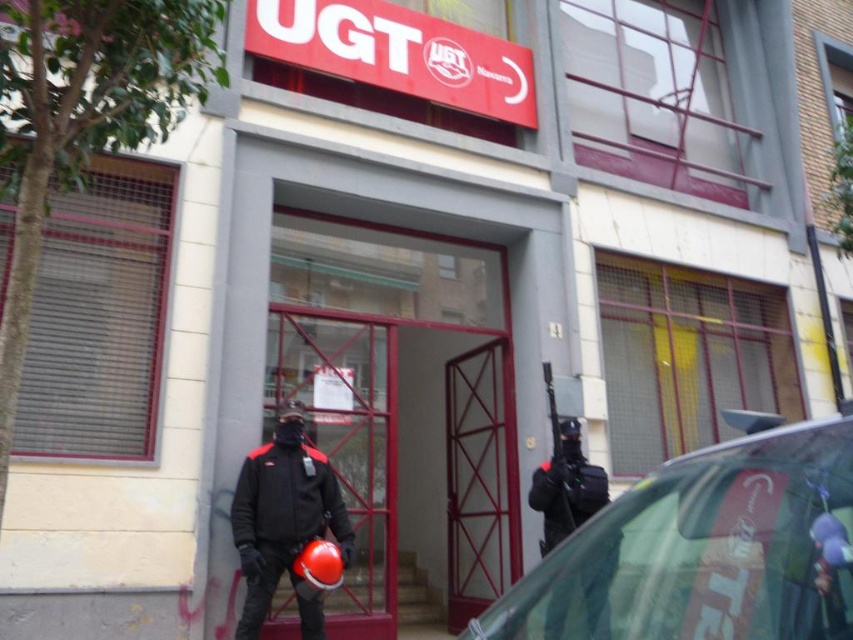
You are a visitor approaching the entrance of UGT building. You notice two security personnel in dark clothing. One has a matte black jacket at center and the other holds a black plastic gun at center. Which object is closer to the ground?

The matte black jacket at center is located below the black plastic gun at center, so the matte black jacket at center is closer to the ground.

You are a visitor approaching the entrance of the UGT building. You notice the black matte uniform at center and the black plastic gun at center. Can you safely walk between them without getting too close? Please explain your reasoning.

The black matte uniform at center and the black plastic gun at center are 3.28 inches apart from each other. Since this distance is very small, walking between them would likely bring you too close, so it is not safe to attempt.

You are standing in front of the UGT building and notice two points marked on the entrance area. Which point, point (299, 474) or point (552, 449), is closer to you?

Point (299, 474) is closer to the viewer than point (552, 449).